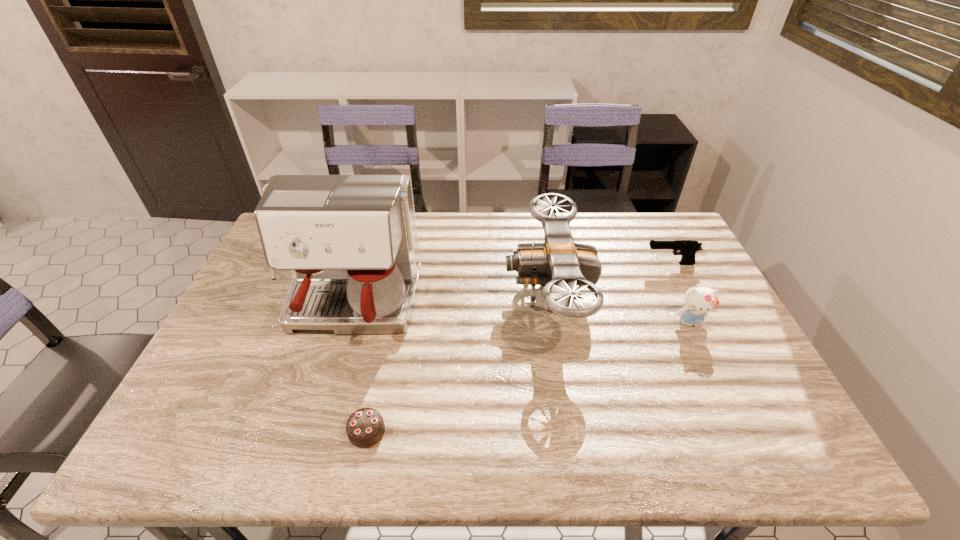
The image size is (960, 540). Find the location of `free space located 0.240m on the front-facing side of the drone`. free space located 0.240m on the front-facing side of the drone is located at coordinates (425, 294).

The width and height of the screenshot is (960, 540). Identify the location of free space located 0.140m on the front-facing side of the kitten. (714, 374).

Identify the location of blank space located 0.070m on the front-facing side of the fourth tallest object. (622, 264).

Locate an element on the screen. Image resolution: width=960 pixels, height=540 pixels. vacant position located 0.140m on the front-facing side of the fourth tallest object is located at coordinates (601, 264).

Locate an element on the screen. The image size is (960, 540). vacant space situated on the front-facing side of the fourth tallest object is located at coordinates (629, 264).

I want to click on vacant space positioned on the right of the shortest object, so click(x=464, y=431).

You are a GUI agent. You are given a task and a screenshot of the screen. Output one action in this format:
    pyautogui.click(x=<x>, y=<y>)
    Task: Click on the object that is at the far edge
    The width and height of the screenshot is (960, 540).
    Given the screenshot: What is the action you would take?
    pyautogui.click(x=559, y=264)

This screenshot has height=540, width=960. Find the location of `object at the near edge`. object at the near edge is located at coordinates (365, 427).

Where is `object at the left edge`? object at the left edge is located at coordinates point(350,241).

Identify the location of kitten present at the right edge. This screenshot has width=960, height=540. (699, 300).